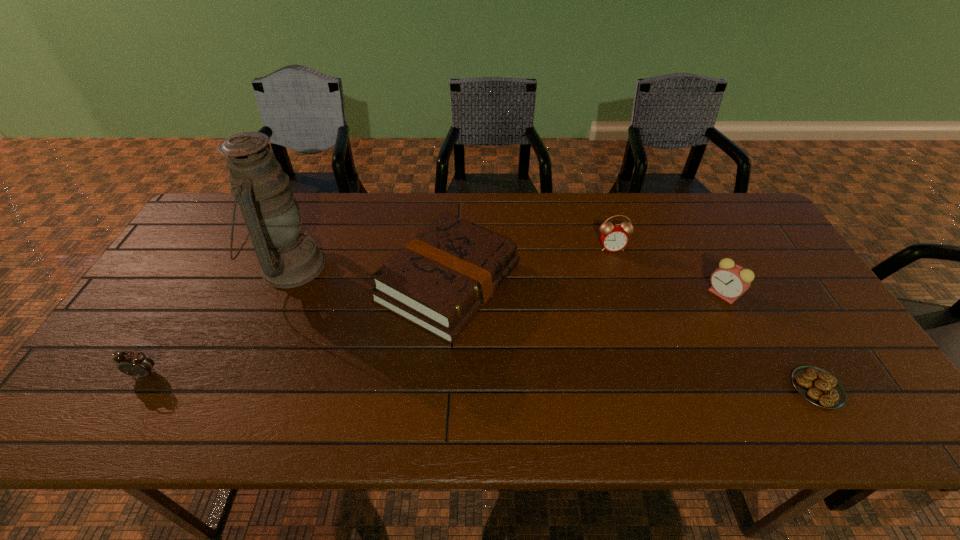
Find the location of a particular element. Image resolution: width=960 pixels, height=540 pixels. oil lamp is located at coordinates (288, 258).

This screenshot has width=960, height=540. In order to click on the second object from left to right in this screenshot , I will do coord(288,258).

Identify the location of the fourth object from left to right. This screenshot has height=540, width=960. (614, 238).

Locate an element on the screen. The width and height of the screenshot is (960, 540). the farthest alarm clock is located at coordinates (614, 238).

Find the location of a particular element. The height and width of the screenshot is (540, 960). the rightmost alarm clock is located at coordinates (729, 281).

Find the location of a particular element. This screenshot has height=540, width=960. the second nearest alarm clock is located at coordinates (729, 281).

Identify the location of the third object from left to right. The height and width of the screenshot is (540, 960). (439, 281).

The image size is (960, 540). What are the coordinates of `the shortest alarm clock` in the screenshot? It's located at (136, 364).

This screenshot has width=960, height=540. In order to click on the nearest alarm clock in this screenshot , I will do `click(136, 364)`.

Locate an element on the screen. The image size is (960, 540). the rightmost object is located at coordinates (816, 385).